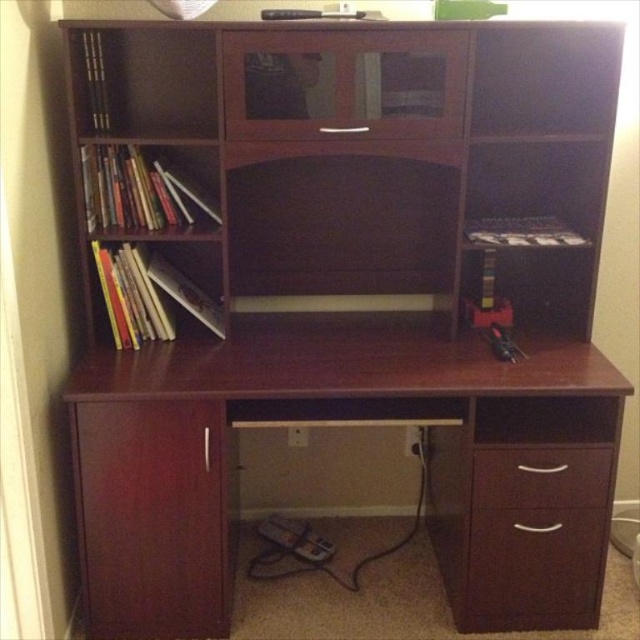
What do you see at coordinates (346, 422) in the screenshot?
I see `mahogany wood desk at center` at bounding box center [346, 422].

Between point (465, 358) and point (524, 561), which one is positioned in front?

Point (524, 561) is in front.

At what (x,y) coordinates should I click in order to perform the action: click on mahogany wood desk at center. Please return your answer as a coordinate pair (x, y). This screenshot has height=640, width=640. Looking at the image, I should click on (346, 422).

The height and width of the screenshot is (640, 640). What do you see at coordinates (534, 568) in the screenshot?
I see `matte wood drawer at lower right` at bounding box center [534, 568].

Does matte wood drawer at lower right have a greater width compared to dark wood drawer at lower right?

Yes.

Between point (534, 579) and point (589, 480), which one is positioned in front?

Point (589, 480) is in front.

Where is `matte wood drawer at lower right`? The image size is (640, 640). matte wood drawer at lower right is located at coordinates (534, 568).

How far apart are mahogany wood desk at center and dark wood drawer at lower right?

mahogany wood desk at center is 9.94 inches from dark wood drawer at lower right.

Which is behind, point (324, 346) or point (545, 451)?

Point (324, 346)

Who is more forward, (445,397) or (611,500)?

Point (445,397) is in front.

At what (x,y) coordinates should I click in order to perform the action: click on mahogany wood desk at center. Please return your answer as a coordinate pair (x, y). The image size is (640, 640). Looking at the image, I should click on (346, 422).